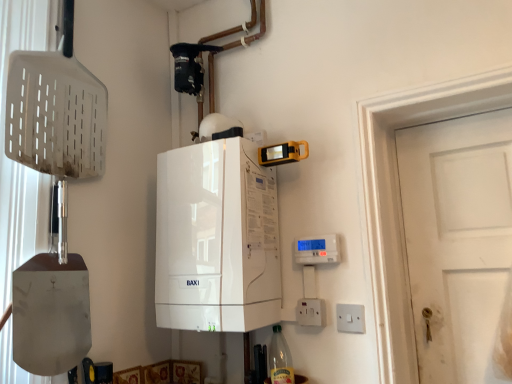
Question: From a real-world perspective, is clear glass bottle at lower center positioned above or below white plastic switch at lower right, placed as the first electric outlet when sorted from right to left?

Choices:
 (A) below
 (B) above

Answer: (A)

Question: Is point (281, 360) closer or farther from the camera than point (345, 327)?

Choices:
 (A) farther
 (B) closer

Answer: (A)

Question: Which is nearer to the clear glass bottle at lower center?

Choices:
 (A) white plastic switch at lower right, which is the second electric outlet from left to right
 (B) white plastic electric outlet at lower right, which is the 1th electric outlet from left to right
 (C) white glossy boiler at center

Answer: (B)

Question: Estimate the real-world distances between objects in this image. Which object is closer to the white plastic electric outlet at lower right, which is the 1th electric outlet from left to right?

Choices:
 (A) white glossy boiler at center
 (B) white plastic switch at lower right, which is the second electric outlet from left to right
 (C) clear glass bottle at lower center

Answer: (B)